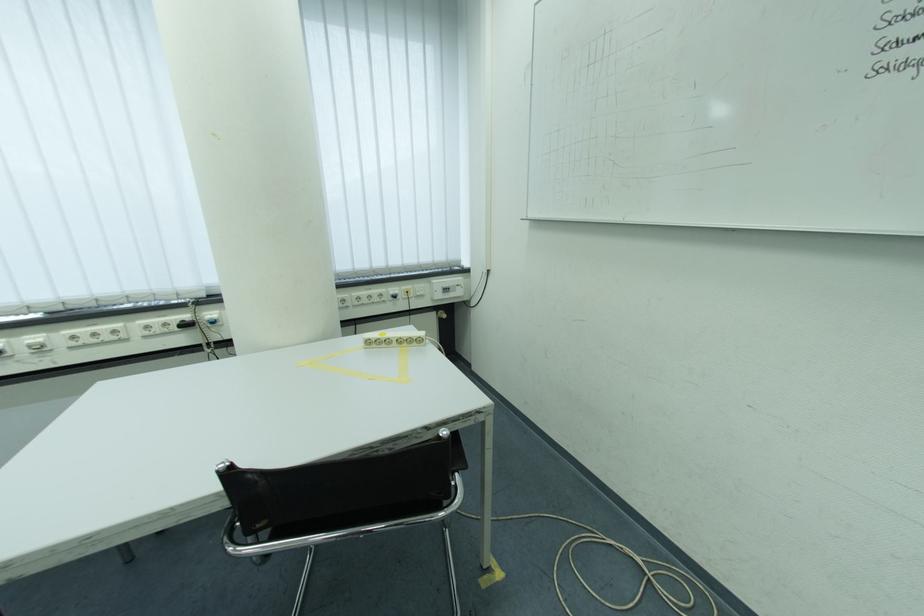
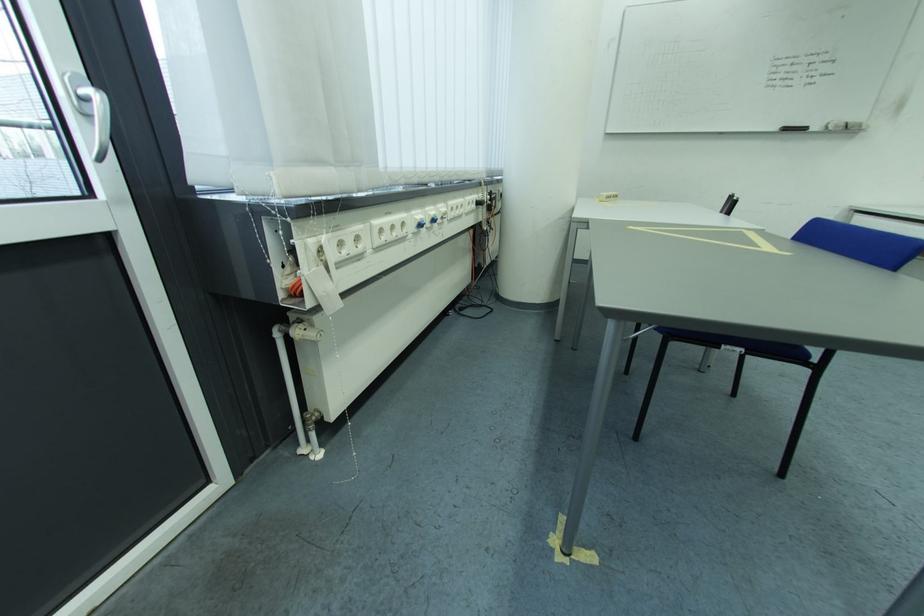
The point at [103,326] is marked in the first image. Where is the corresponding point in the second image?

(465, 200)